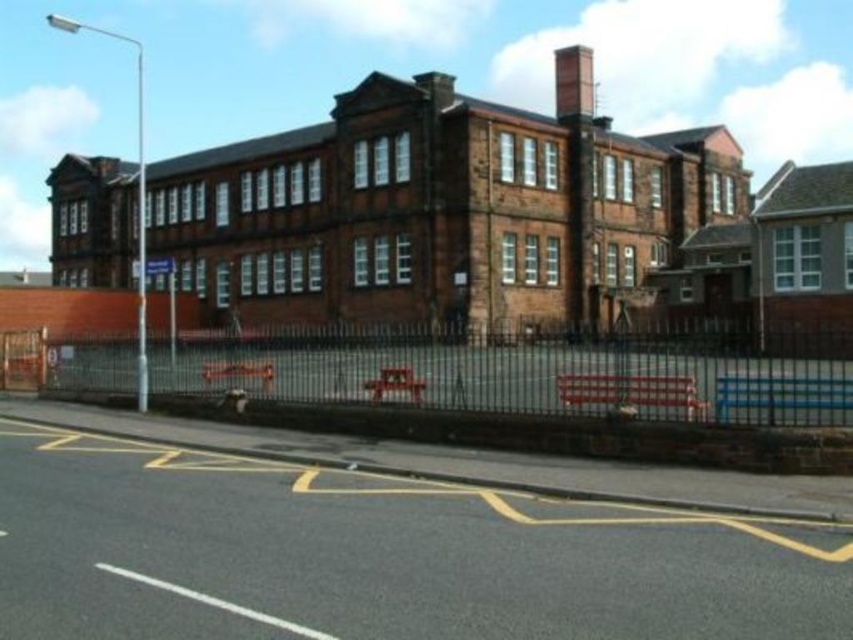
You are a maintenance worker who needs to access the smooth brick chimney at upper center for repairs. The black metal fence at lower center is blocking your path. Can you walk around the fence to reach the chimney?

The black metal fence at lower center is located below the smooth brick chimney at upper center, meaning the chimney is above the fence. Since the fence is at ground level and the chimney is on the roof, you can access the chimney by going around the fence to the building and ascending to the roof.

You are standing in front of the building and want to walk towards the entrance. Where is the black metal fence at lower center located relative to your current position?

The black metal fence at lower center is located at point (531, 371), which is directly in front of you, so you will encounter it before reaching the entrance.

You are standing in front of the building and see two points marked on the fence. The first point is at coordinates point (606, 337) and the second is at point (581, 83). Which of these points is closer to the entrance of the building?

Point (606, 337) is in front of point (581, 83), so it is closer to the entrance of the building.